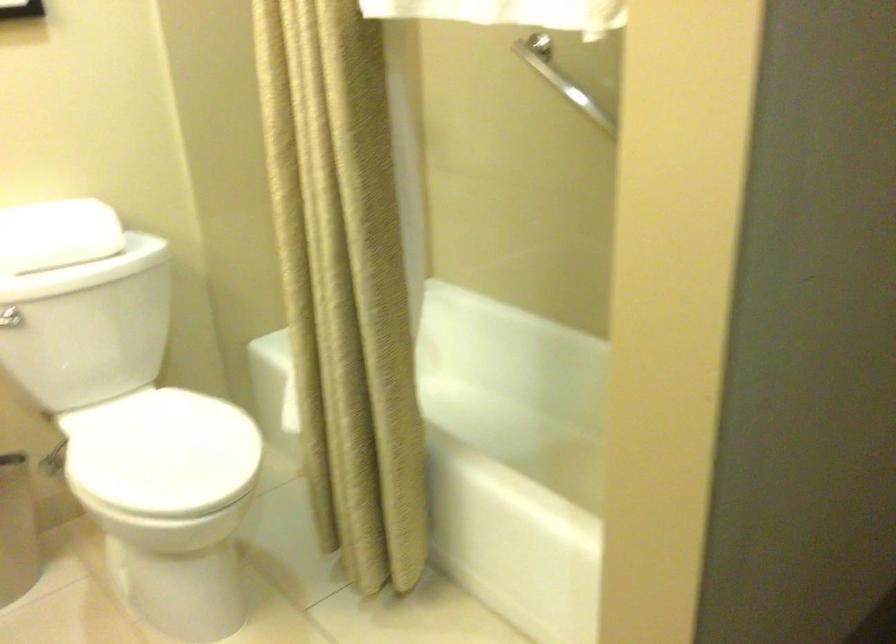
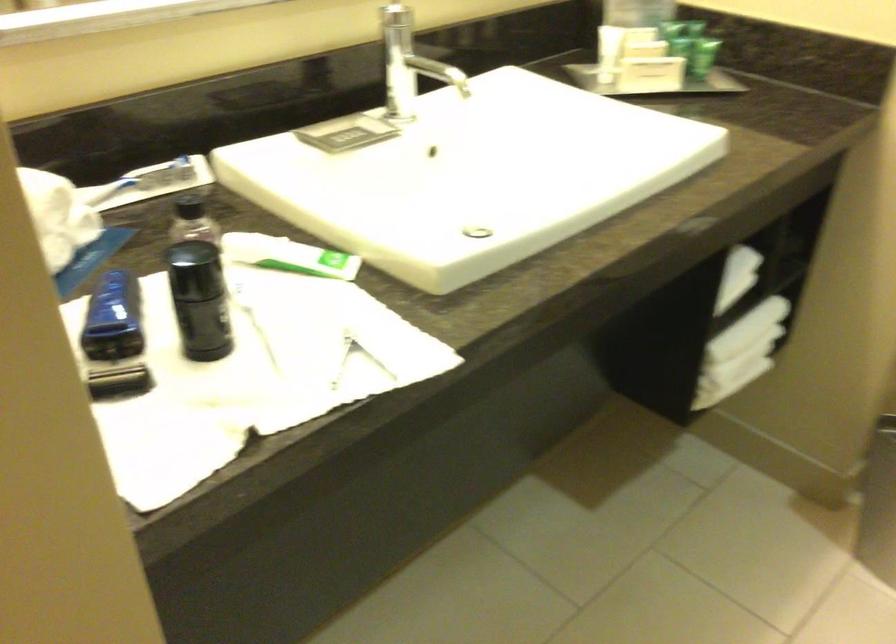
The first image is from the beginning of the video and the second image is from the end. How did the camera likely rotate when shooting the video?

The camera rotated toward left-down.